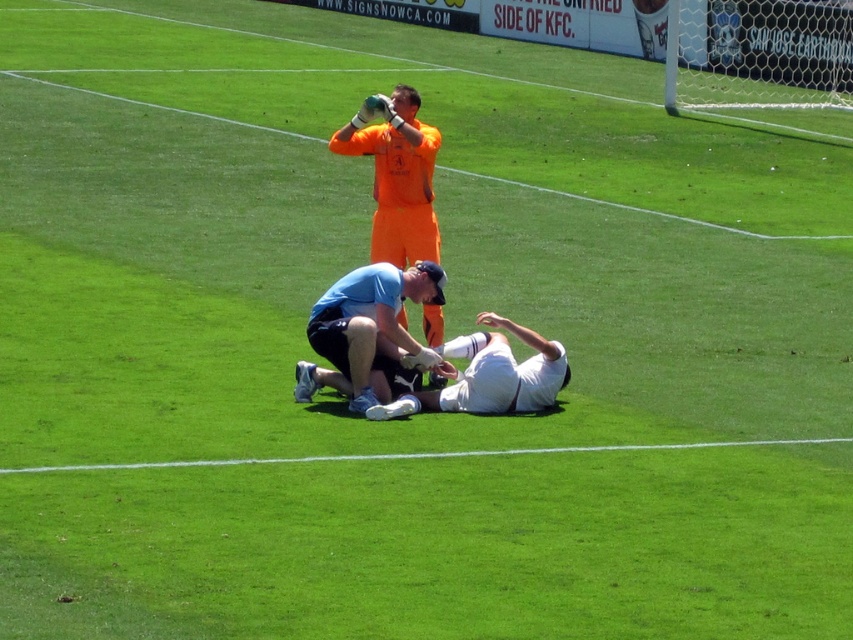
Question: Does blue fabric knee at center have a smaller size compared to white matte uniform at center?

Choices:
 (A) yes
 (B) no

Answer: (B)

Question: In this image, where is blue fabric knee at center located relative to white matte uniform at center?

Choices:
 (A) above
 (B) below

Answer: (A)

Question: Among these points, which one is farthest from the camera?

Choices:
 (A) (358, 284)
 (B) (485, 394)

Answer: (A)

Question: Is blue fabric knee at center thinner than white matte uniform at center?

Choices:
 (A) no
 (B) yes

Answer: (B)

Question: Which of the following is the farthest from the observer?

Choices:
 (A) blue fabric knee at center
 (B) white matte uniform at center

Answer: (B)

Question: Which of the following is the farthest from the observer?

Choices:
 (A) blue fabric knee at center
 (B) white matte uniform at center

Answer: (B)